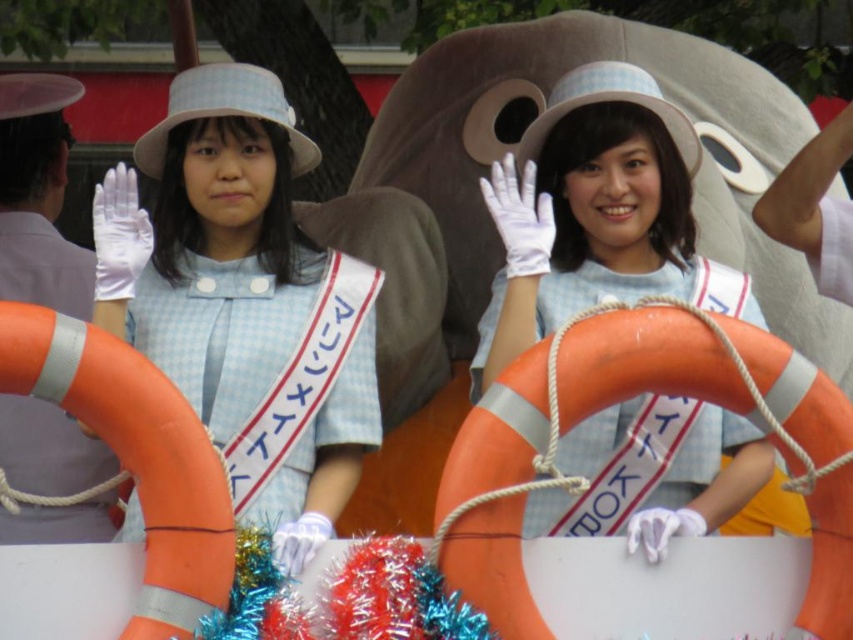
Can you confirm if matte blue dress at center is taller than matte blue sailor dress at center?

Yes.

Is matte blue dress at center positioned in front of matte blue sailor dress at center?

Yes, matte blue dress at center is closer to the viewer.

Measure the distance between matte blue dress at center and camera.

A distance of 170.17 feet exists between matte blue dress at center and camera.

The image size is (853, 640). Find the location of `matte blue dress at center`. matte blue dress at center is located at coordinates (241, 300).